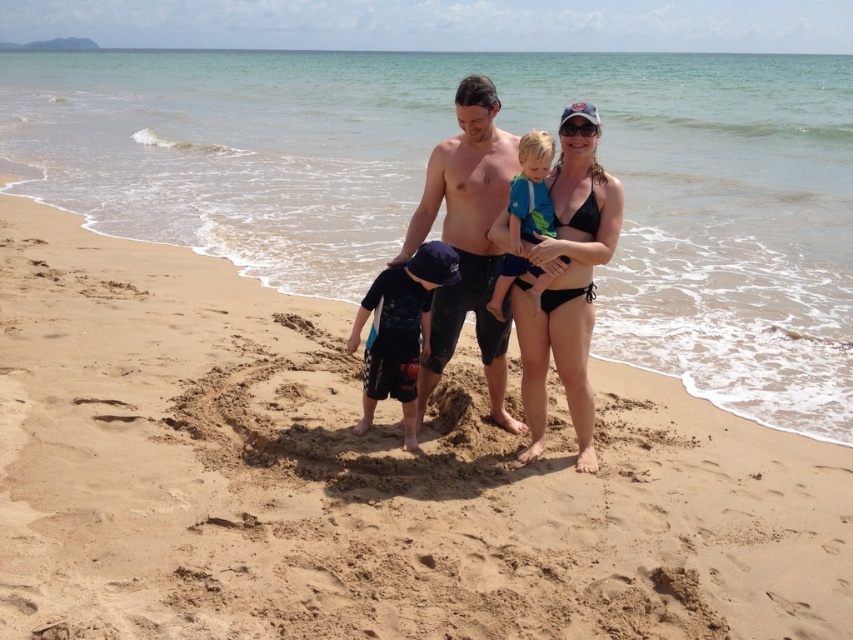
You are standing on the beach and see two points marked on the sand. One is at point (592, 289) and the other at point (570, 124). Which point is closer to your current position?

Point (570, 124) is closer to your current position because it is closer to the camera than point (592, 289).

You are a photographer trying to capture the black bikini at center in the image. According to the coordinates provided, where exactly should you focus your camera lens?

The black bikini at center is located at coordinates point (x=567, y=288), so you should focus your camera lens there.